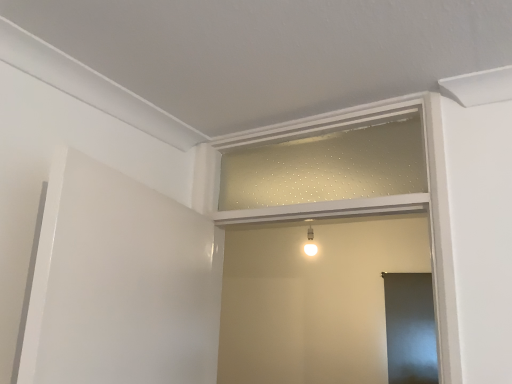
Question: Should I look upward or downward to see white matte window frame at center, the first window frame ordered from the bottom?

Choices:
 (A) up
 (B) down

Answer: (B)

Question: From the image's perspective, is matte gray screen door at lower right located beneath clear glass window frame at center, the 2th window frame from the bottom?

Choices:
 (A) no
 (B) yes

Answer: (B)

Question: Considering the relative positions of matte gray screen door at lower right and clear glass window frame at center, marked as the 1th window frame in a top-to-bottom arrangement, in the image provided, is matte gray screen door at lower right behind clear glass window frame at center, marked as the 1th window frame in a top-to-bottom arrangement,?

Choices:
 (A) no
 (B) yes

Answer: (B)

Question: Is matte gray screen door at lower right oriented away from clear glass window frame at center, the 2th window frame from the bottom?

Choices:
 (A) no
 (B) yes

Answer: (A)

Question: Is matte gray screen door at lower right completely or partially outside of clear glass window frame at center, the 2th window frame from the bottom?

Choices:
 (A) no
 (B) yes

Answer: (B)

Question: Does matte gray screen door at lower right lie in front of clear glass window frame at center, the 2th window frame from the bottom?

Choices:
 (A) no
 (B) yes

Answer: (A)

Question: Is matte gray screen door at lower right to the right of clear glass window frame at center, the 2th window frame from the bottom, from the viewer's perspective?

Choices:
 (A) yes
 (B) no

Answer: (A)

Question: Can you confirm if clear glass window frame at center, the 2th window frame from the bottom, is taller than matte gray screen door at lower right?

Choices:
 (A) no
 (B) yes

Answer: (A)

Question: From the image's perspective, is clear glass window frame at center, the 2th window frame from the bottom, located above matte gray screen door at lower right?

Choices:
 (A) no
 (B) yes

Answer: (B)

Question: Can you confirm if clear glass window frame at center, the 2th window frame from the bottom, is positioned to the left of matte gray screen door at lower right?

Choices:
 (A) no
 (B) yes

Answer: (B)

Question: Considering the relative sizes of clear glass window frame at center, the 2th window frame from the bottom, and matte gray screen door at lower right in the image provided, is clear glass window frame at center, the 2th window frame from the bottom, bigger than matte gray screen door at lower right?

Choices:
 (A) yes
 (B) no

Answer: (B)

Question: Is clear glass window frame at center, the 2th window frame from the bottom, oriented towards matte gray screen door at lower right?

Choices:
 (A) no
 (B) yes

Answer: (A)

Question: Is clear glass window frame at center, the 2th window frame from the bottom, positioned with its back to matte gray screen door at lower right?

Choices:
 (A) yes
 (B) no

Answer: (B)

Question: From the image's perspective, does clear glass window frame at center, the 2th window frame from the bottom, appear lower than white matte window frame at center, which is the 2th window frame from top to bottom?

Choices:
 (A) no
 (B) yes

Answer: (A)